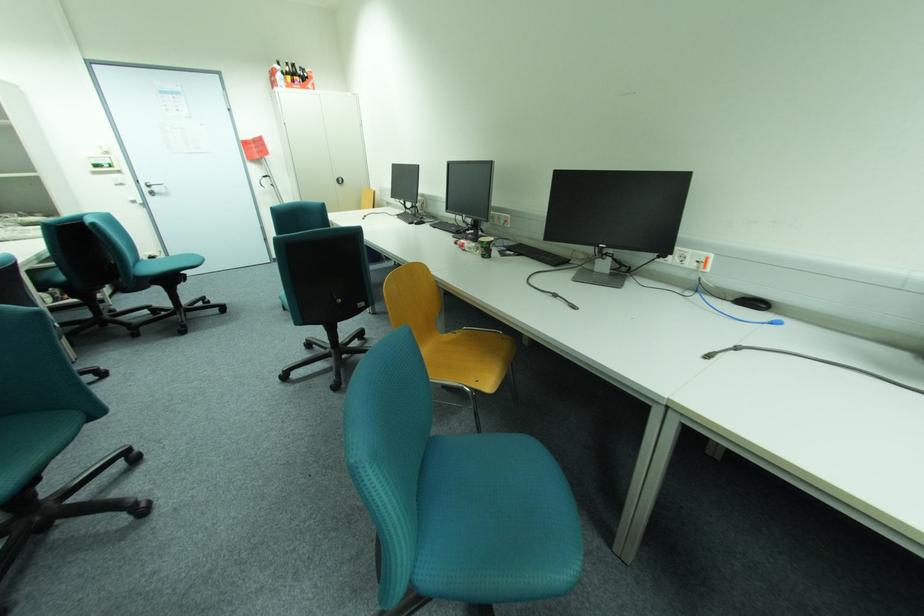
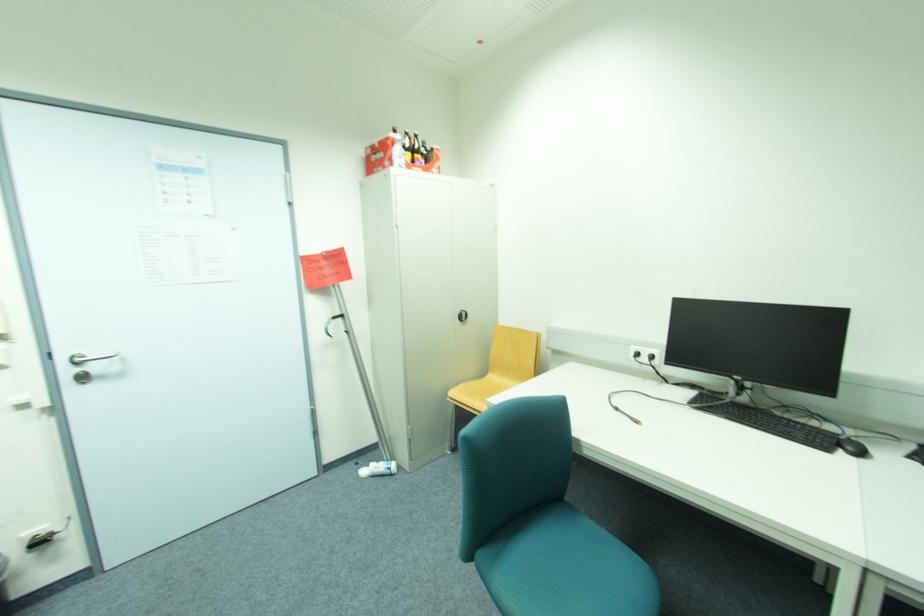
Find the pixel in the second image that matches point 152,190 in the first image.

(74, 371)